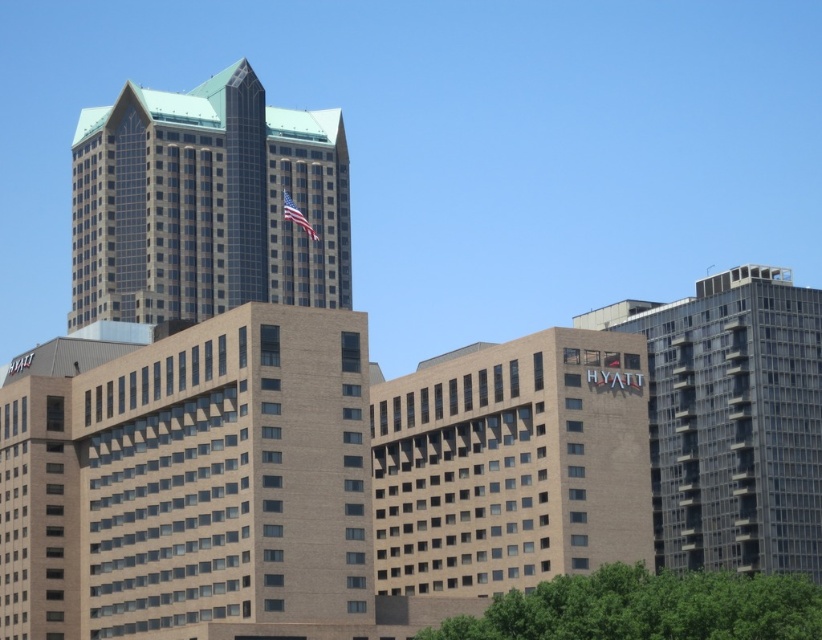
In the scene shown: You are standing at the center of the city and see a point marked at coordinates (733, 420). Which building does this point indicate? Please choose from the objects listed in the scene description.

The point at (733, 420) marks the glassy reflective building at right.

You are a drone operator tasked with delivering a package from the green glass skyscraper at upper left to the green leafy tree at lower center. The drone has a maximum flight range of 60 meters. Can the drone complete the delivery without needing to recharge?

The distance between the green glass skyscraper at upper left and the green leafy tree at lower center is 59.20 meters, which is within the drone operator drone has a maximum flight range of 60 meters. The drone can complete the delivery without needing to recharge.

You are standing in the city park and see the glassy reflective building at right and the green leafy tree at lower center. Which object is positioned higher in the image?

The glassy reflective building at right is located above the green leafy tree at lower center, so it is positioned higher in the image.